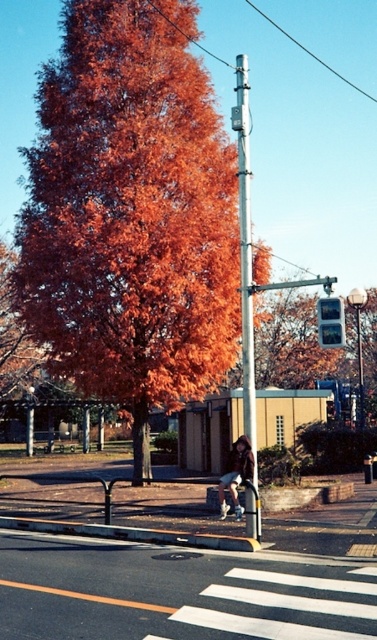
Can you confirm if silver metallic pole at center is bigger than denim jacket at center?

Yes.

Is point (239, 177) less distant than point (229, 461)?

Yes, it is in front of point (229, 461).

Between point (248, 129) and point (242, 467), which one is positioned behind?

Positioned behind is point (242, 467).

Locate an element on the screen. silver metallic pole at center is located at coordinates (245, 252).

Can you confirm if orange leafy tree at center is taller than silver metallic pole at center?

In fact, orange leafy tree at center may be shorter than silver metallic pole at center.

Looking at this image, does orange leafy tree at center appear over silver metallic pole at center?

Incorrect, orange leafy tree at center is not positioned above silver metallic pole at center.

Measure the distance between point (x=200, y=131) and camera.

68.60 feet

Where is `orange leafy tree at center`? orange leafy tree at center is located at coordinates (130, 212).

Does silver metallic pole at center appear on the right side of metallic gray traffic light at center-right?

Indeed, silver metallic pole at center is positioned on the right side of metallic gray traffic light at center-right.

Who is positioned more to the left, silver metallic pole at center or metallic gray traffic light at center-right?

metallic gray traffic light at center-right is more to the left.

Which is behind, point (242, 289) or point (335, 316)?

The point (242, 289) is behind.

The width and height of the screenshot is (377, 640). I want to click on silver metallic pole at center, so click(x=245, y=252).